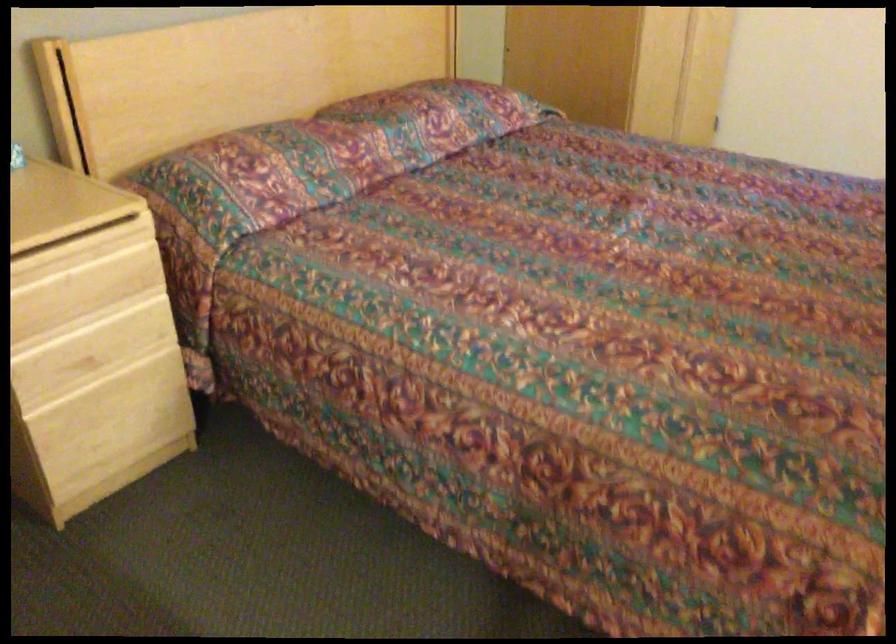
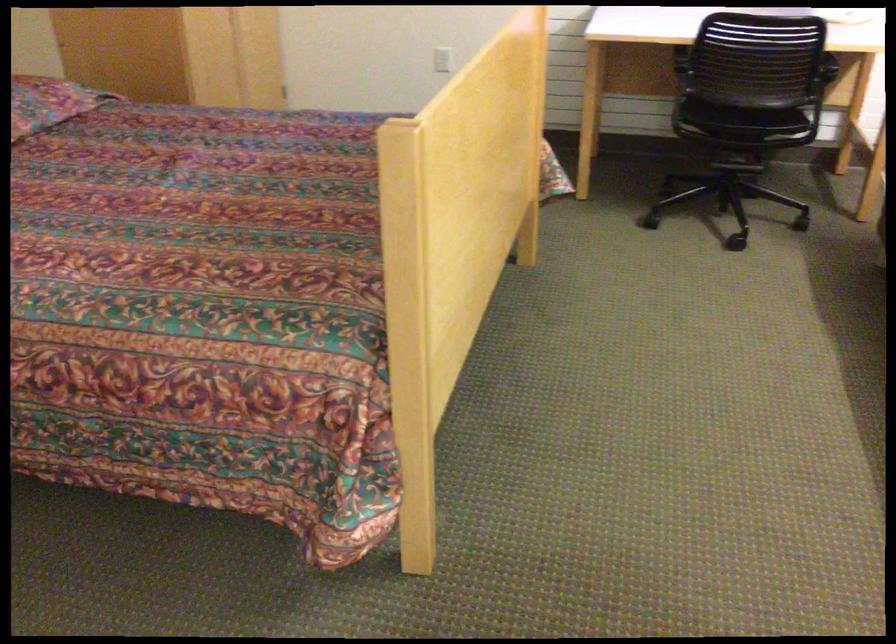
In the second image, find the point that corresponds to (497,109) in the first image.

(48, 102)